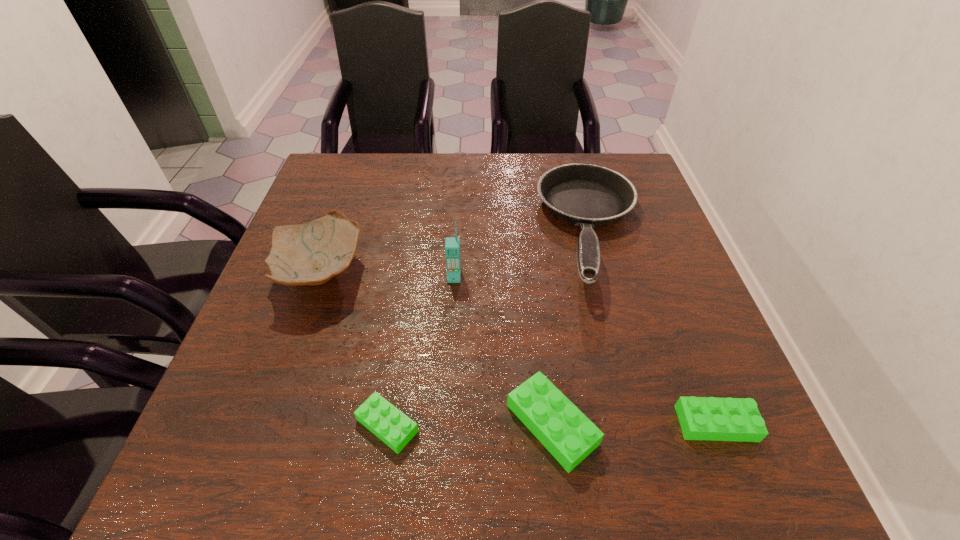
The width and height of the screenshot is (960, 540). I want to click on pottery, so click(x=312, y=253).

The height and width of the screenshot is (540, 960). Identify the location of blank space located on the back of the shortest object. (406, 305).

Find the location of a particular element. The width and height of the screenshot is (960, 540). blank space located 0.400m on the left of the third shortest object is located at coordinates (274, 424).

The image size is (960, 540). Find the location of `free space located on the left of the second tallest Lego`. free space located on the left of the second tallest Lego is located at coordinates click(x=451, y=423).

You are a GUI agent. You are given a task and a screenshot of the screen. Output one action in this format:
    pyautogui.click(x=<x>, y=<y>)
    Task: Click on the free space located on the keypad of the cellular telephone
    Image resolution: width=960 pixels, height=540 pixels.
    Given the screenshot: What is the action you would take?
    pyautogui.click(x=451, y=334)

Find the location of a particular element. The image size is (960, 540). vacant area situated on the left of the frying pan is located at coordinates (508, 231).

The width and height of the screenshot is (960, 540). I want to click on free space located on the right of the pottery, so click(467, 273).

Image resolution: width=960 pixels, height=540 pixels. Find the location of `object situated at the far edge`. object situated at the far edge is located at coordinates (587, 195).

Identify the location of object at the left edge. (312, 253).

This screenshot has width=960, height=540. Find the location of `Lego at the right edge`. Lego at the right edge is located at coordinates (701, 418).